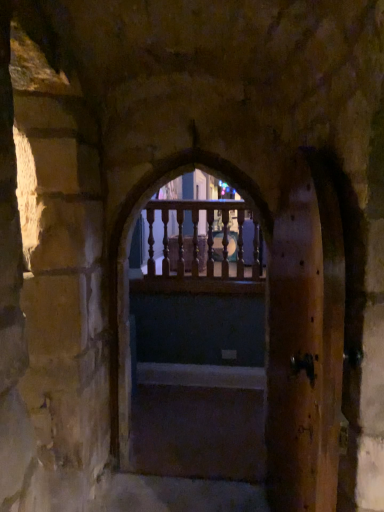
Locate an element on the screen. The image size is (384, 512). free space above transparent wooden railing at center (from a real-world perspective) is located at coordinates (197, 196).